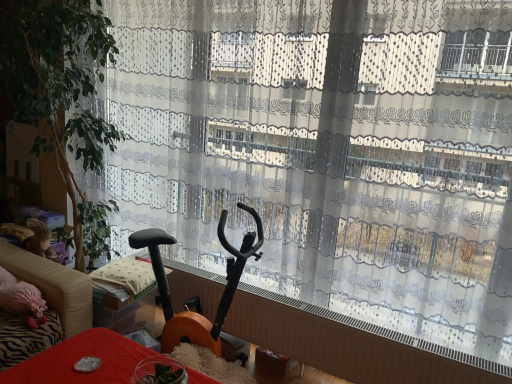
Question: Relative to translucent glass bowl at lower center, placed as the 2th furniture when sorted from top to bottom, is beige fabric couch at left in front or behind?

Choices:
 (A) front
 (B) behind

Answer: (B)

Question: In terms of width, does beige fabric couch at left look wider or thinner when compared to translucent glass bowl at lower center, the first furniture in the front-to-back sequence?

Choices:
 (A) thin
 (B) wide

Answer: (B)

Question: Estimate the real-world distances between objects in this image. Which object is closer to the green leafy plant at left?

Choices:
 (A) translucent glass bowl at lower center, the 2th furniture when ordered from back to front
 (B) beige fabric couch at left
 (C) black plastic exercise bike at left, which is the 1th furniture from back to front
 (D) wooden matte exercise bike at center

Answer: (B)

Question: Which is nearer to the beige fabric couch at left?

Choices:
 (A) green leafy plant at left
 (B) wooden matte exercise bike at center
 (C) translucent glass bowl at lower center, placed as the 2th furniture when sorted from top to bottom
 (D) black plastic exercise bike at left, which appears as the first furniture when viewed from the top

Answer: (D)